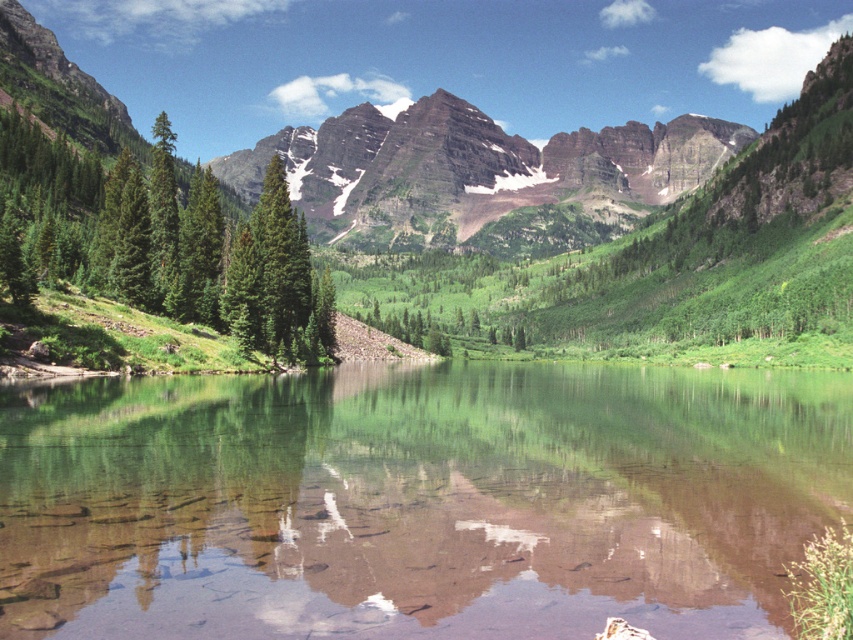
Question: Does rugged granite mountain at center appear on the left side of green matte tree at center?

Choices:
 (A) no
 (B) yes

Answer: (A)

Question: Can you confirm if green matte tree at left is smaller than green matte tree at center?

Choices:
 (A) yes
 (B) no

Answer: (B)

Question: Which object is the closest to the rugged granite mountain at center?

Choices:
 (A) green matte tree at left
 (B) green matte tree at center

Answer: (A)

Question: Which point is closer to the camera?

Choices:
 (A) clear water at center
 (B) green matte tree at center

Answer: (A)

Question: Is clear water at center behind green matte tree at left?

Choices:
 (A) yes
 (B) no

Answer: (B)

Question: Which of the following is the closest to the observer?

Choices:
 (A) rugged granite mountain at center
 (B) green matte tree at center
 (C) clear water at center

Answer: (C)